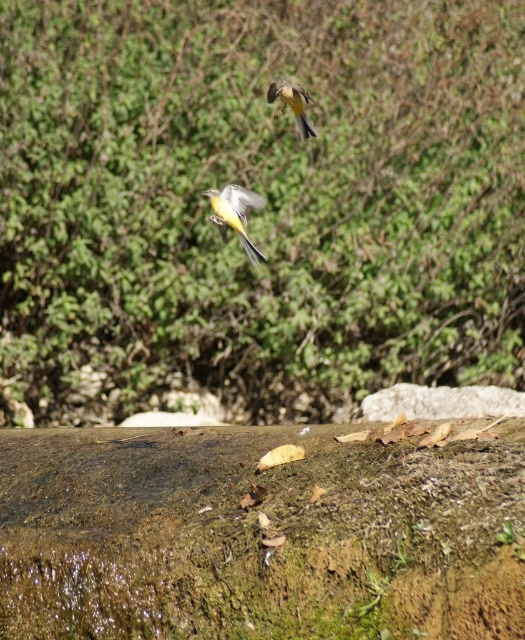
Question: Which object is closer to the camera taking this photo?

Choices:
 (A) yellow matte bird at center
 (B) yellow-green feathers at upper center
 (C) mossy rock at lower center

Answer: (A)

Question: Can you confirm if mossy rock at lower center is positioned below yellow-green feathers at upper center?

Choices:
 (A) yes
 (B) no

Answer: (A)

Question: Considering the real-world distances, which object is closest to the mossy rock at lower center?

Choices:
 (A) yellow matte bird at center
 (B) yellow-green feathers at upper center

Answer: (A)

Question: Does mossy rock at lower center have a smaller size compared to yellow matte bird at center?

Choices:
 (A) yes
 (B) no

Answer: (B)

Question: Which of the following is the closest to the observer?

Choices:
 (A) (239, 237)
 (B) (513, 404)
 (C) (315, 134)

Answer: (A)

Question: Is yellow matte bird at center below yellow-green feathers at upper center?

Choices:
 (A) no
 (B) yes

Answer: (B)